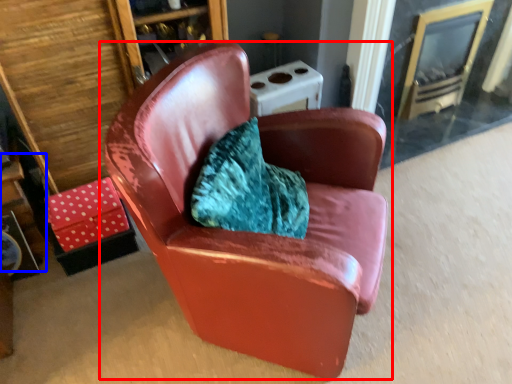
Question: Which of the following is the closest to the observer, chair (highlighted by a red box) or table (highlighted by a blue box)?

Choices:
 (A) chair
 (B) table

Answer: (A)